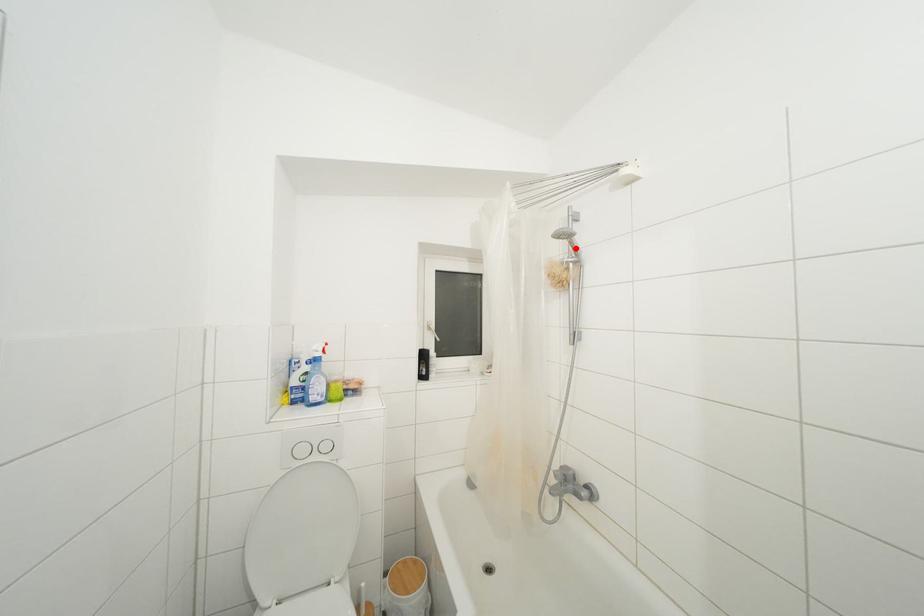
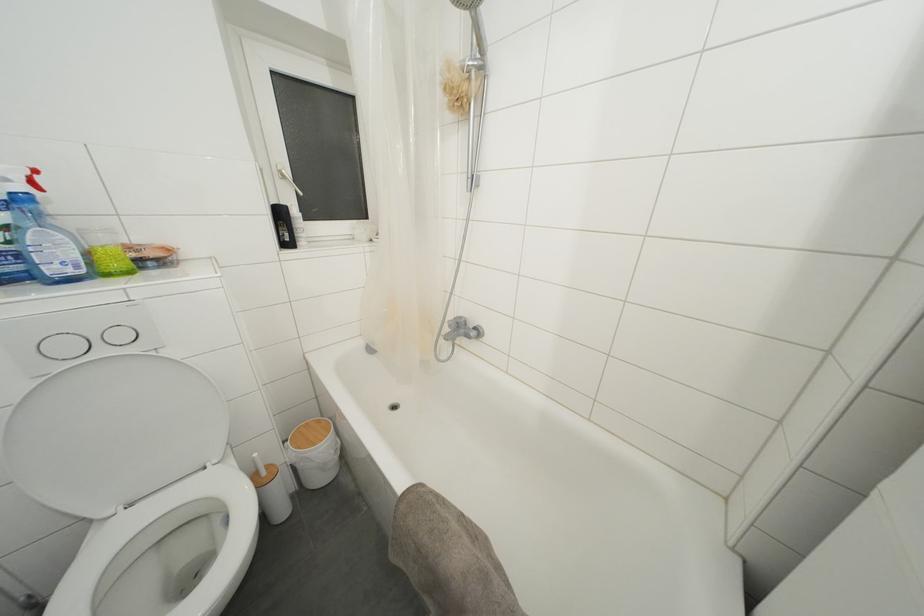
Where in the second image is the point corresponding to the highlighted location from the first image?

(480, 31)